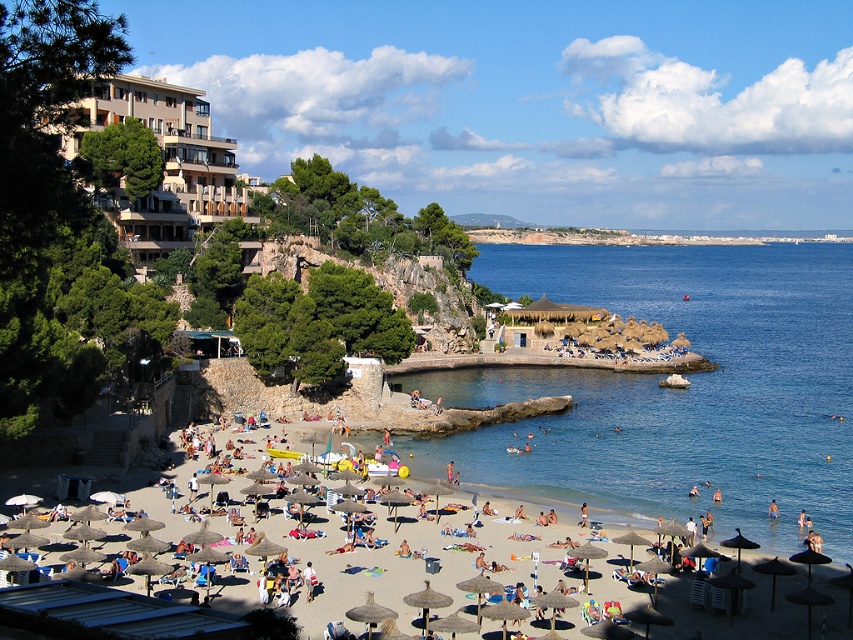
You are a tourist staying at the beige concrete building at upper left and want to reach the beige sand beach at lower center. How would you get there?

The beige concrete building at upper left is positioned over the beige sand beach at lower center, so you can go down from the building to reach the beach.

You are a lifeguard on duty at the beach. You need to determine if the blue water at beach center is wider than the beige sand beach at lower center. Can you confirm this based on the scene?

The blue water at beach center might be wider than beige sand beach at lower center according to the description.